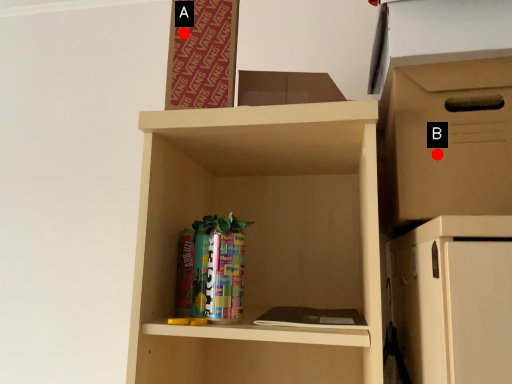
Question: Two points are circled on the image, labeled by A and B beside each circle. Among these points, which one is nearest to the camera?

Choices:
 (A) A is closer
 (B) B is closer

Answer: (B)